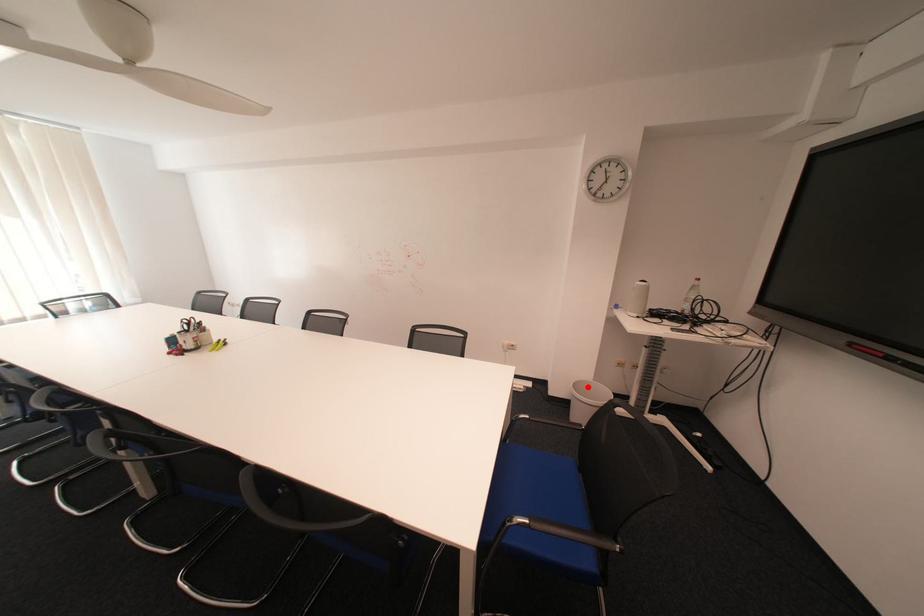
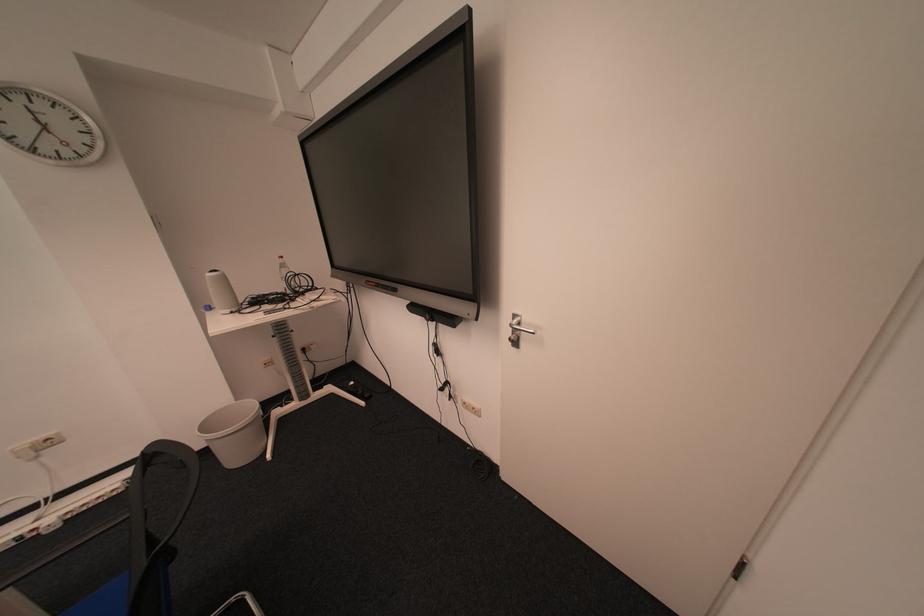
Locate, in the second image, the point that corresponds to the highlighted location in the first image.

(216, 426)